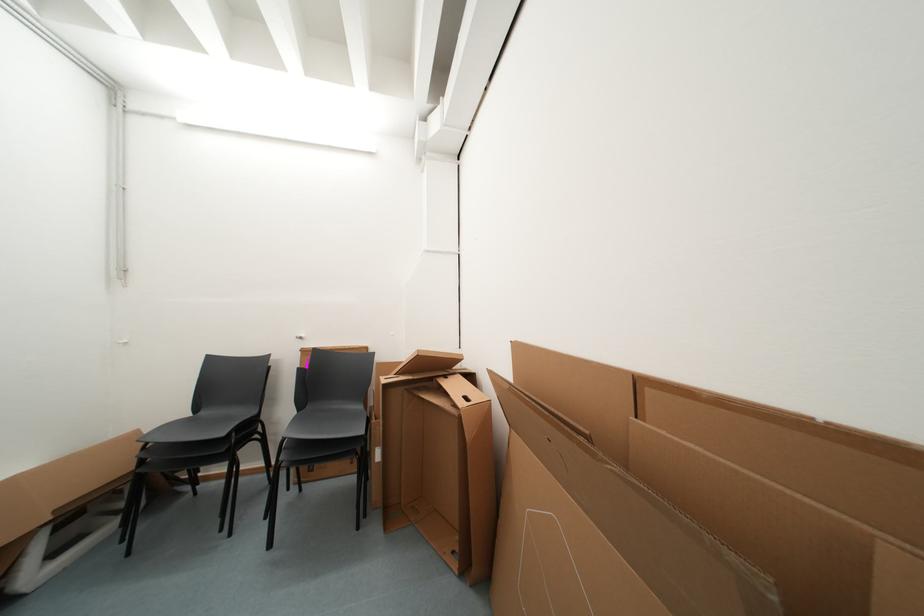
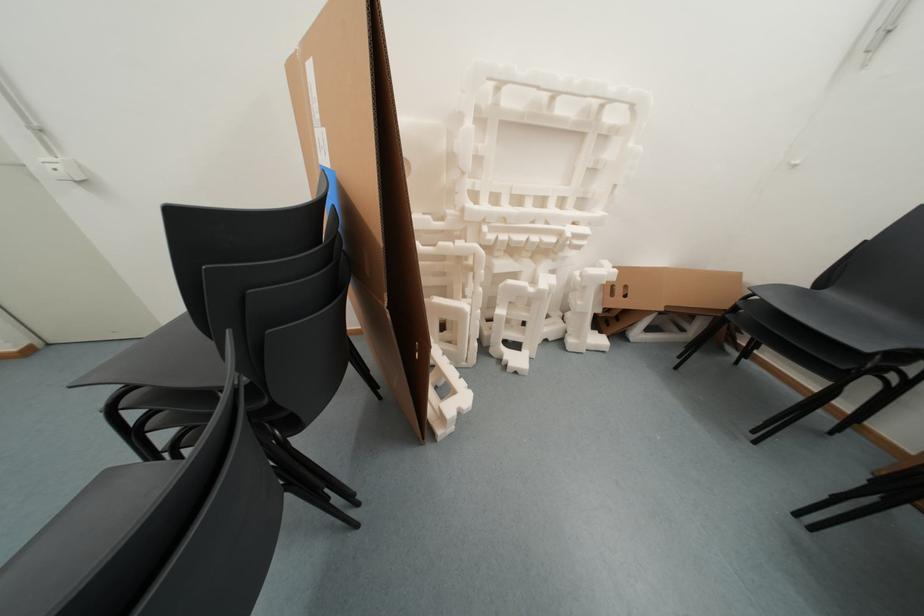
First-person continuous shooting, in which direction is the camera rotating?

The camera's rotation is toward left-down.